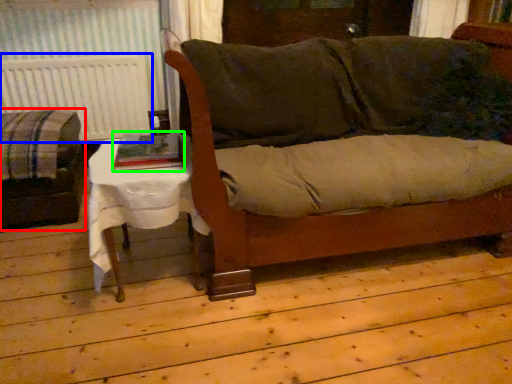
Question: Estimate the real-world distances between objects in this image. Which object is closer to studio couch (highlighted by a red box), radiator (highlighted by a blue box) or book (highlighted by a green box)?

Choices:
 (A) radiator
 (B) book

Answer: (A)